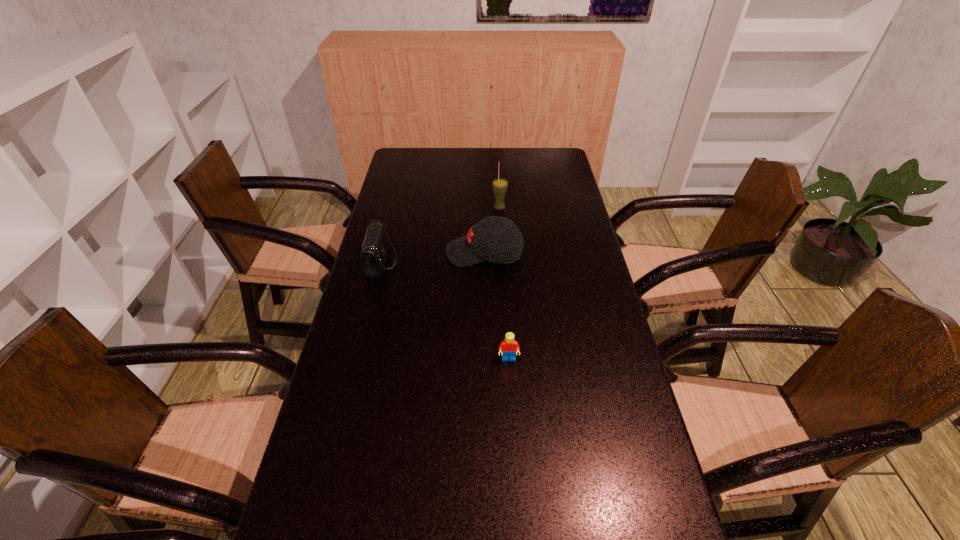
The width and height of the screenshot is (960, 540). In order to click on vacant space situated on the face of the Lego in this screenshot , I will do `click(514, 447)`.

Identify the location of object present at the left edge. (374, 247).

In the image, there is a desktop. Where is `vacant region at the far edge`? The width and height of the screenshot is (960, 540). vacant region at the far edge is located at coordinates (517, 161).

In the image, there is a desktop. Identify the location of free region at the left edge. (401, 204).

This screenshot has height=540, width=960. I want to click on free location at the right edge of the desktop, so click(613, 433).

Where is `free location at the far left corner of the desktop`? Image resolution: width=960 pixels, height=540 pixels. free location at the far left corner of the desktop is located at coordinates (392, 171).

In the image, there is a desktop. In order to click on vacant region at the far right corner in this screenshot , I will do (533, 176).

You are a GUI agent. You are given a task and a screenshot of the screen. Output one action in this format:
    pyautogui.click(x=<x>, y=<y>)
    Task: Click on the empty location between the clutch bag and the tallest object
    
    Given the screenshot: What is the action you would take?
    pyautogui.click(x=441, y=234)

Locate an element on the screen. This screenshot has height=540, width=960. free area in between the baseball cap and the leftmost object is located at coordinates (433, 257).

Where is `free space between the third shortest object and the leftmost object`? This screenshot has height=540, width=960. free space between the third shortest object and the leftmost object is located at coordinates (433, 257).